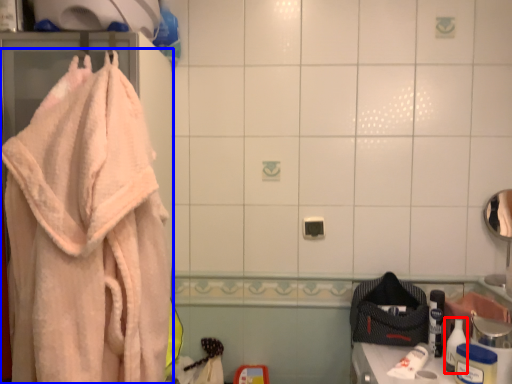
Question: Among these objects, which one is nearest to the camera, toiletry (highlighted by a red box) or towel (highlighted by a blue box)?

Choices:
 (A) toiletry
 (B) towel

Answer: (B)